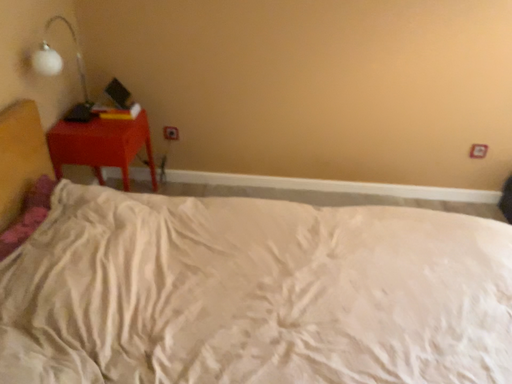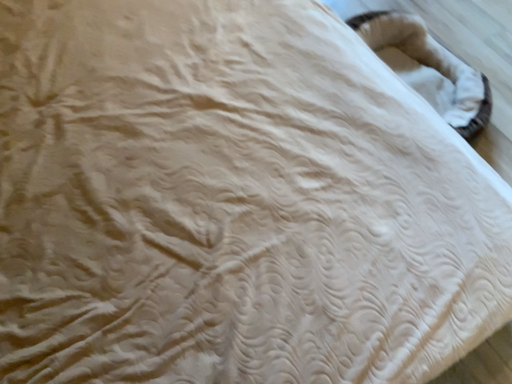
Question: How did the camera likely rotate when shooting the video?

Choices:
 (A) rotated right
 (B) rotated left

Answer: (A)